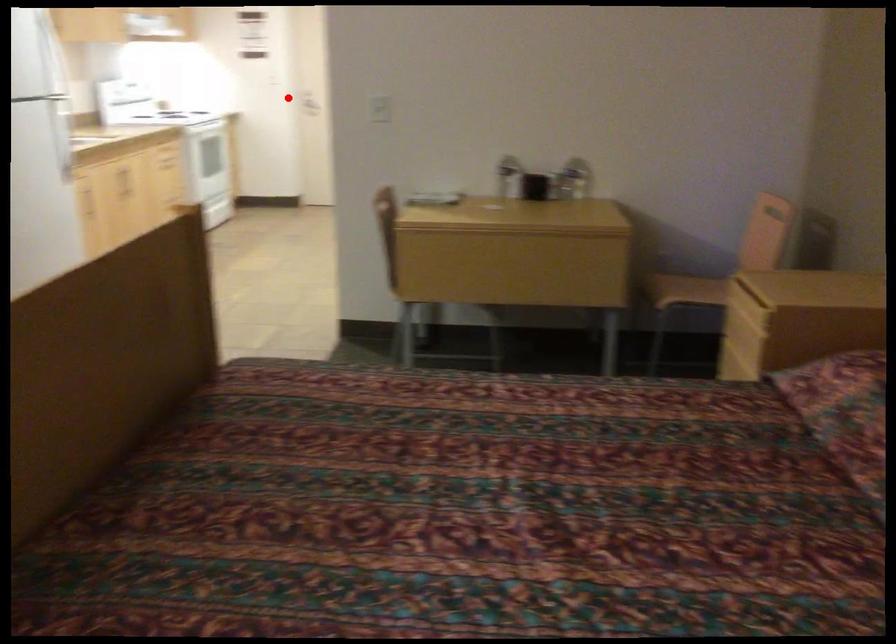
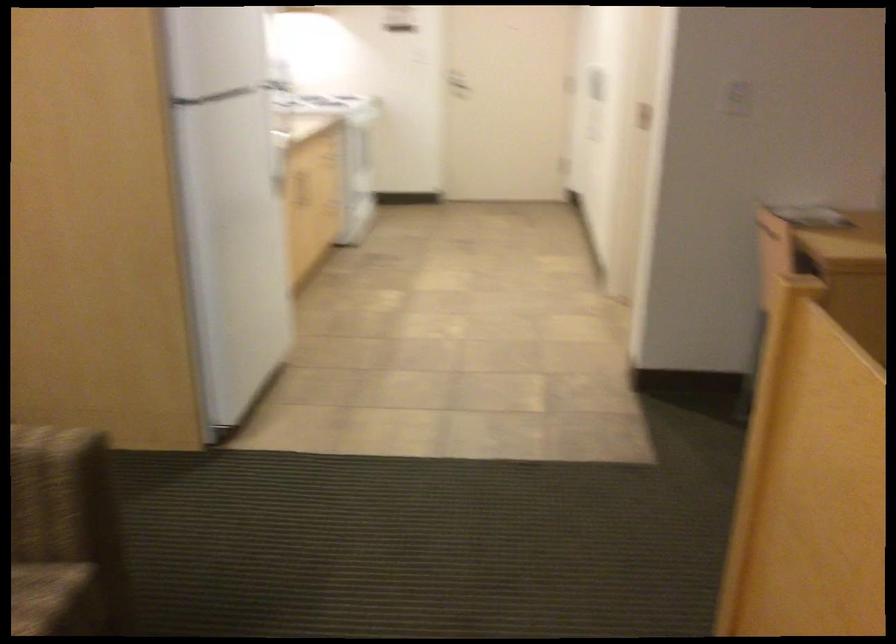
The point at the highlighted location is marked in the first image. Where is the corresponding point in the second image?

(455, 84)